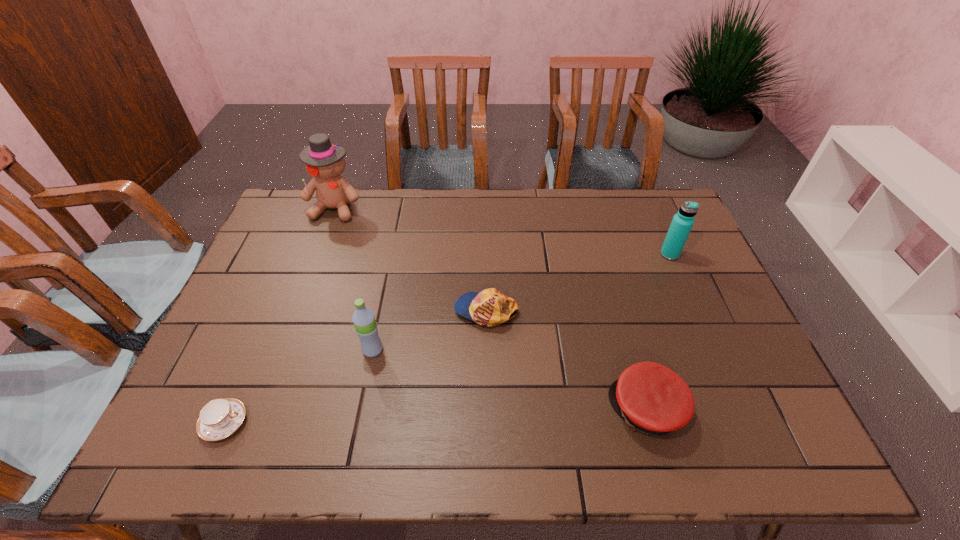
In the image, there is a desktop. Identify the location of vacant space at the near edge. click(x=432, y=446).

In the image, there is a desktop. Where is `vacant space at the left edge`? The image size is (960, 540). vacant space at the left edge is located at coordinates (279, 323).

The image size is (960, 540). Identify the location of free location at the right edge of the desktop. click(x=721, y=296).

Locate an element on the screen. vacant space at the far left corner is located at coordinates (294, 205).

Find the location of a particular element. This screenshot has height=540, width=960. free region at the far right corner is located at coordinates (636, 213).

Locate an element on the screen. This screenshot has height=540, width=960. empty space that is in between the right water bottle and the tallest object is located at coordinates (502, 231).

Locate an element on the screen. unoccupied area between the teacup and the rightmost object is located at coordinates (447, 339).

This screenshot has width=960, height=540. Identify the location of vacant area that lies between the second object from right to left and the rightmost object. (659, 332).

Where is `vacant area between the fourth object from right to left and the right cap`? vacant area between the fourth object from right to left and the right cap is located at coordinates (510, 380).

I want to click on vacant space that is in between the rightmost object and the shortest object, so click(x=447, y=339).